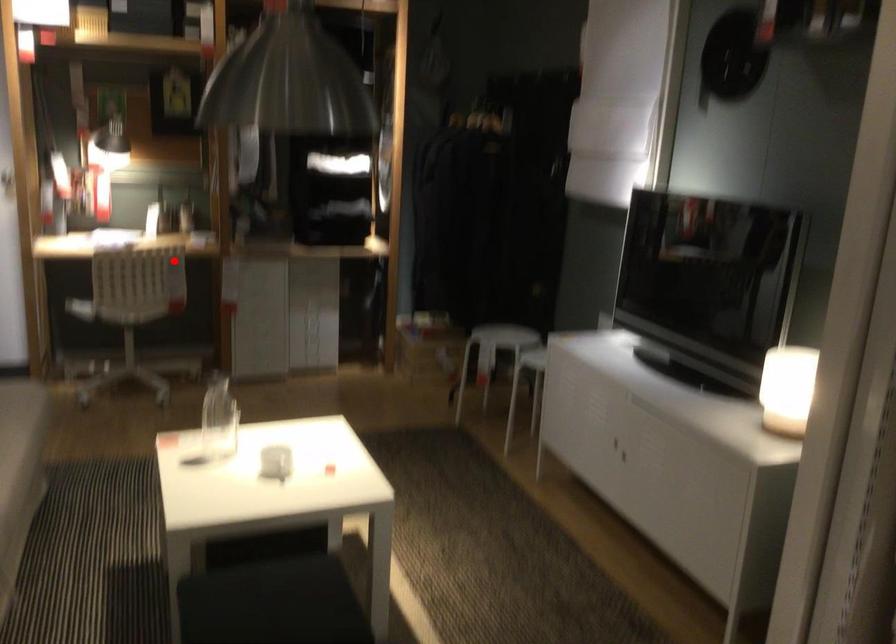
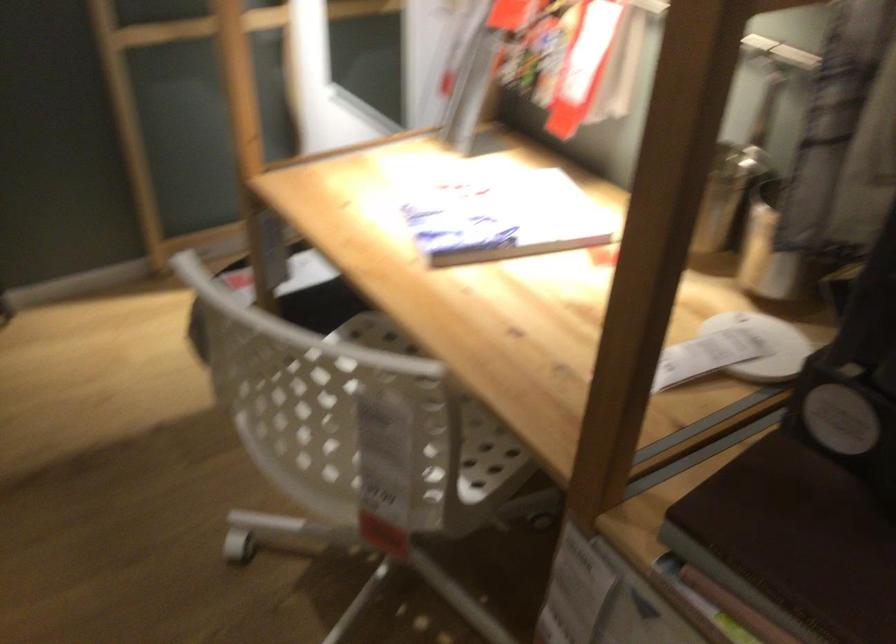
Question: I am providing you with two images of the same scene from different viewpoints. A red point is marked on the first image. Can you still see the location of the red point in image 2?

Choices:
 (A) Yes
 (B) No

Answer: (A)